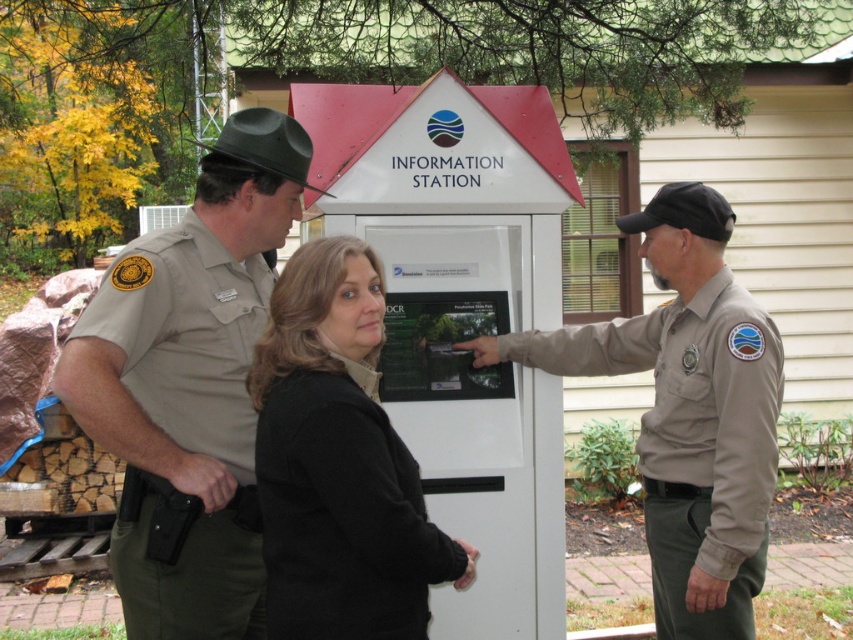
Can you confirm if khaki uniform at center is positioned to the left of tan/cotton shirt at center?

Correct, you'll find khaki uniform at center to the left of tan/cotton shirt at center.

Which is behind, point (172, 461) or point (683, 561)?

Point (683, 561)

I want to click on khaki uniform at center, so click(189, 387).

Can you confirm if khaki uniform at center is taller than black fleece jacket at center?

Correct, khaki uniform at center is much taller as black fleece jacket at center.

Is khaki uniform at center below black fleece jacket at center?

Actually, khaki uniform at center is above black fleece jacket at center.

What do you see at coordinates (189, 387) in the screenshot? The height and width of the screenshot is (640, 853). I see `khaki uniform at center` at bounding box center [189, 387].

The width and height of the screenshot is (853, 640). Identify the location of khaki uniform at center. (189, 387).

Which is more to the right, black leather jacket at center or black fleece jacket at center?

black leather jacket at center is more to the right.

Which of these two, black leather jacket at center or black fleece jacket at center, stands taller?

With more height is black leather jacket at center.

You are a GUI agent. You are given a task and a screenshot of the screen. Output one action in this format:
    pyautogui.click(x=<x>, y=<y>)
    Task: Click on the black leather jacket at center
    
    Given the screenshot: What is the action you would take?
    pyautogui.click(x=531, y=408)